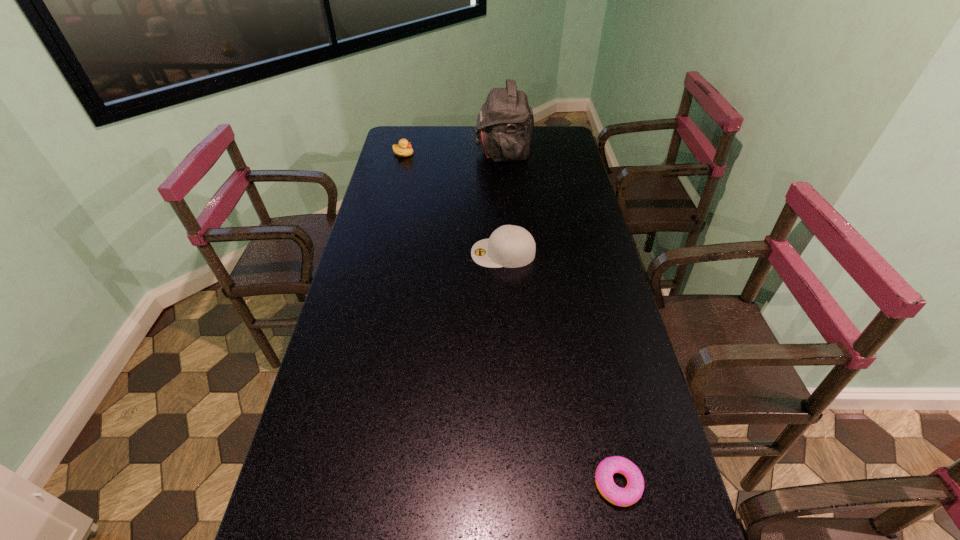
This screenshot has height=540, width=960. In order to click on unoccupied area between the leftmost object and the rightmost object in this screenshot , I will do `click(511, 319)`.

What are the coordinates of `vacant space in between the tallest object and the second shortest object` in the screenshot? It's located at (453, 152).

Identify the location of vacant space that is in between the cap and the doughnut. click(x=561, y=368).

Find the location of `free spot between the third shortest object and the shortest object`. free spot between the third shortest object and the shortest object is located at coordinates (561, 368).

This screenshot has width=960, height=540. I want to click on the third closest object to the tallest object, so click(x=623, y=497).

Locate an element on the screen. The image size is (960, 540). object that is the second closest to the doughnut is located at coordinates (505, 124).

Find the location of a particular element. vacant region that satisfies the following two spatial constraints: 1. on the open flap of the rightmost object; 2. on the left side of the tallest object is located at coordinates (528, 483).

Where is `free space in the image that satisfies the following two spatial constraints: 1. on the back side of the doughnut; 2. at the face of the third tallest object`? The width and height of the screenshot is (960, 540). free space in the image that satisfies the following two spatial constraints: 1. on the back side of the doughnut; 2. at the face of the third tallest object is located at coordinates [547, 153].

What are the coordinates of `free space that satisfies the following two spatial constraints: 1. at the face of the second shortest object; 2. on the left side of the doughnut` in the screenshot? It's located at (324, 483).

Locate an element on the screen. vacant space that satisfies the following two spatial constraints: 1. at the face of the duckling; 2. on the left side of the doughnut is located at coordinates (324, 483).